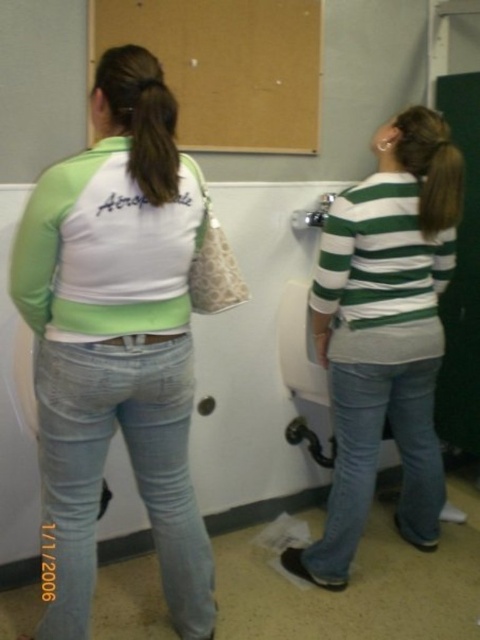
Question: Can you confirm if light blue denim jeans at lower left is positioned to the left of blue denim jeans at lower right?

Choices:
 (A) yes
 (B) no

Answer: (A)

Question: Is light blue denim jeans at center wider than blue denim jeans at lower right?

Choices:
 (A) no
 (B) yes

Answer: (A)

Question: Which object is closer to the camera taking this photo?

Choices:
 (A) green striped shirt at upper right
 (B) light blue denim jeans at lower left
 (C) brown silky hair at upper left
 (D) blue denim jeans at lower right

Answer: (C)

Question: Which object appears farthest from the camera in this image?

Choices:
 (A) light blue denim jeans at lower left
 (B) blue denim jeans at lower right
 (C) brown hair at upper center

Answer: (B)

Question: Estimate the real-world distances between objects in this image. Which object is farther from the blue denim jeans at lower right?

Choices:
 (A) brown hair at upper center
 (B) light blue denim jeans at center
 (C) green striped shirt at upper right
 (D) brown silky hair at upper left

Answer: (D)

Question: Can you confirm if green striped shirt at upper right is positioned to the left of light blue denim jeans at lower left?

Choices:
 (A) no
 (B) yes

Answer: (A)